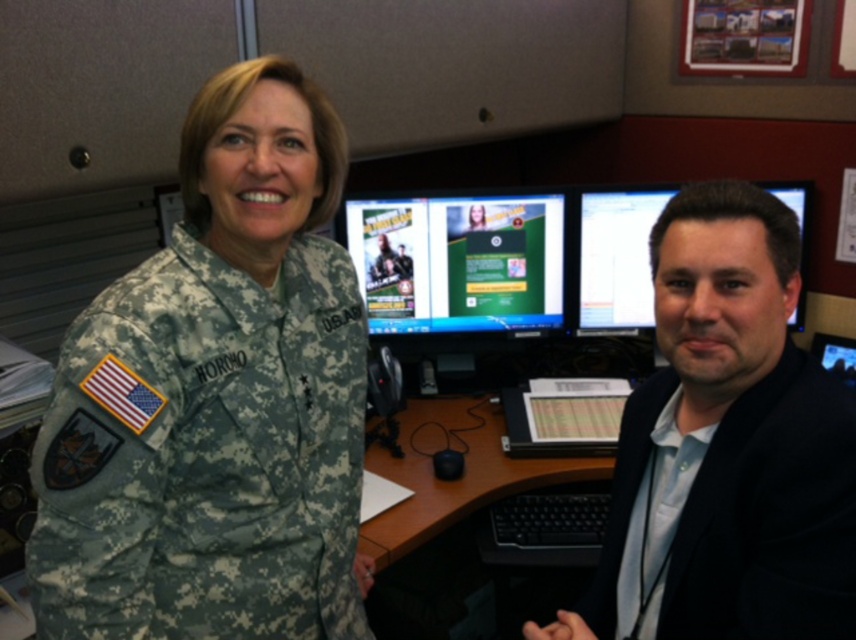
Is camouflage uniform at center wider than black smooth suit at right?

In fact, camouflage uniform at center might be narrower than black smooth suit at right.

Who is positioned more to the right, camouflage uniform at center or black smooth suit at right?

black smooth suit at right

Does point (215, 518) lie behind point (813, 442)?

Yes, point (215, 518) is farther from viewer.

Find the location of a particular element. The image size is (856, 640). camouflage uniform at center is located at coordinates (215, 400).

Can you confirm if camouflage uniform at center is taller than matte black monitor at right?

Correct, camouflage uniform at center is much taller as matte black monitor at right.

Does camouflage uniform at center appear over matte black monitor at right?

No, camouflage uniform at center is not above matte black monitor at right.

Which is in front, point (123, 316) or point (602, 324)?

Point (123, 316)

At what (x,y) coordinates should I click in order to perform the action: click on camouflage uniform at center. Please return your answer as a coordinate pair (x, y). This screenshot has height=640, width=856. Looking at the image, I should click on (215, 400).

Which is more to the right, black smooth suit at right or green matte screen at center?

black smooth suit at right

Locate an element on the screen. This screenshot has height=640, width=856. black smooth suit at right is located at coordinates (726, 448).

Who is more distant from viewer, (640, 576) or (396, 282)?

Positioned behind is point (396, 282).

Find the location of a particular element. This screenshot has width=856, height=640. black smooth suit at right is located at coordinates tap(726, 448).